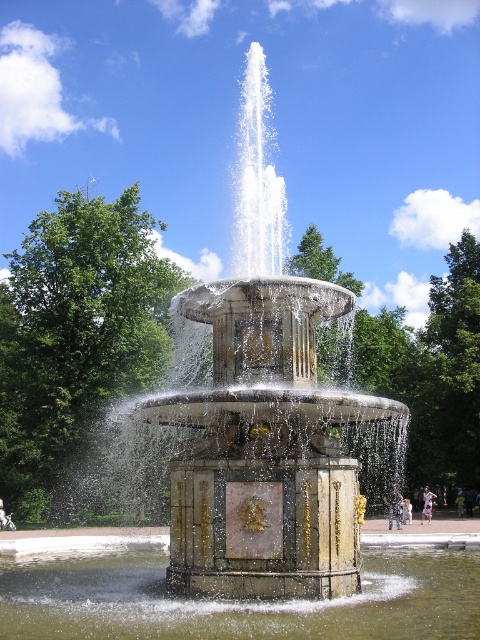
You are standing in the park and see the white marble fountain at center and the clear water at fountain center. Which object is positioned more to the left?

The clear water at fountain center is positioned more to the left than the white marble fountain at center.

You are standing in the park looking at the fountain. You notice two points marked on the fountain structure. One is at coordinate point (334,428) and the other at point (105,600). Which point is closer to your current position?

Point (105,600) is closer to your current position because it is closer to the viewer than point (334,428).

You are a maintenance worker tasked with cleaning the white marble fountain at center and the clear water at fountain center. You have a 1.2 meter wide cleaning tool. Can you fit the tool between the two objects without touching either?

The white marble fountain at center might be wider than clear water at fountain center, so it is uncertain whether the 1.2 meter wide tool can fit between them without touching. Check the actual width difference first.